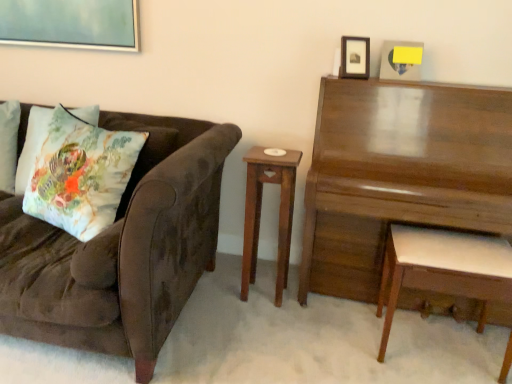
Find the location of a particular element. free spot in front of wooden picture frame at upper right, acting as the 1th picture frame starting from the right is located at coordinates (409, 89).